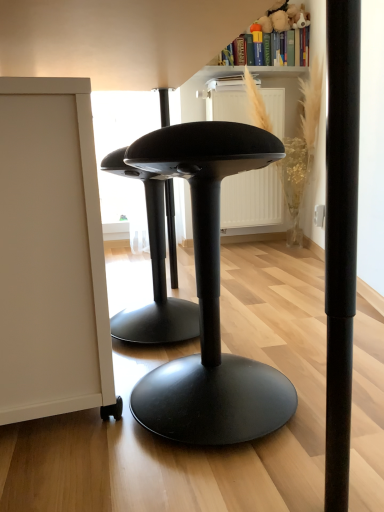
What is the approximate width of matte black stool at center?

The width of matte black stool at center is 16.66 inches.

Describe the element at coordinates (210, 298) in the screenshot. I see `matte black stool at center` at that location.

Where is `matte black stool at center`? This screenshot has width=384, height=512. matte black stool at center is located at coordinates (210, 298).

Identify the location of matte black stool at center. This screenshot has width=384, height=512. (210, 298).